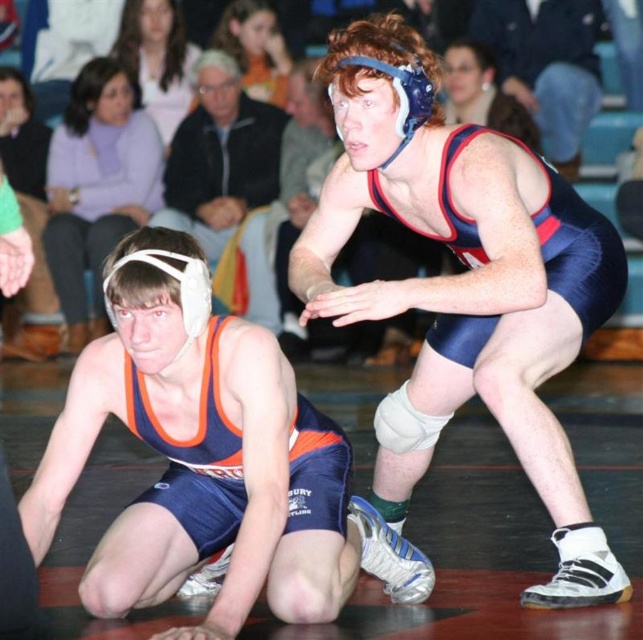
You are a referee in a wrestling match and need to determine which wrestler is in control. Based on the image, which wrestler is positioned higher, the matte blue wrestling singlet at upper center or the blue fabric wrestling singlet at upper center?

The matte blue wrestling singlet at upper center is much taller as blue fabric wrestling singlet at upper center, so the matte blue wrestling singlet at upper center is positioned higher.

You are a photographer standing at the point marked as point (177, 188). You want to take a photo of the wrestling match happening on the mat. Considering your current position, can you estimate how far you are from the spectators watching the match?

The distance between point (177, 188) and the viewer is 34.28 feet. Since the spectators are in the background behind the mat, the distance from the photographer at point (177, 188) to the spectators would be greater than 34.28 feet.